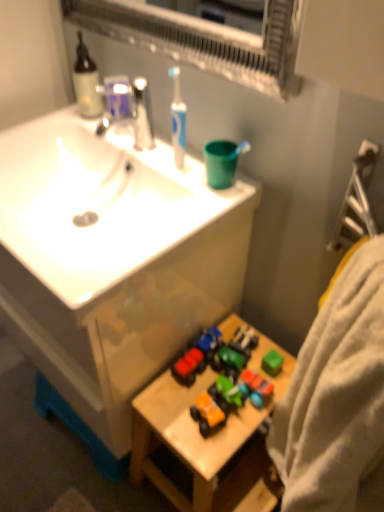
Question: Would you say translucent glass soap dispenser at upper left is a long distance from wooden toy at lower right?

Choices:
 (A) yes
 (B) no

Answer: (B)

Question: Is translucent glass soap dispenser at upper left oriented towards wooden toy at lower right?

Choices:
 (A) yes
 (B) no

Answer: (B)

Question: Is translucent glass soap dispenser at upper left looking in the opposite direction of wooden toy at lower right?

Choices:
 (A) yes
 (B) no

Answer: (B)

Question: Can you confirm if translucent glass soap dispenser at upper left is positioned to the left of wooden toy at lower right?

Choices:
 (A) no
 (B) yes

Answer: (B)

Question: From a real-world perspective, is translucent glass soap dispenser at upper left physically below wooden toy at lower right?

Choices:
 (A) no
 (B) yes

Answer: (A)

Question: Considering the positions of white glossy sink at upper left and translucent glass soap dispenser at upper left in the image, is white glossy sink at upper left taller or shorter than translucent glass soap dispenser at upper left?

Choices:
 (A) tall
 (B) short

Answer: (A)

Question: Looking at their shapes, would you say white glossy sink at upper left is wider or thinner than translucent glass soap dispenser at upper left?

Choices:
 (A) wide
 (B) thin

Answer: (A)

Question: Is point (112, 353) closer or farther from the camera than point (77, 46)?

Choices:
 (A) farther
 (B) closer

Answer: (B)

Question: From a real-world perspective, is white glossy sink at upper left positioned above or below translucent glass soap dispenser at upper left?

Choices:
 (A) below
 (B) above

Answer: (A)

Question: From their relative heights in the image, would you say orange matte toy car at lower center, acting as the third toy starting from the right, is taller or shorter than rubberized plastic toy car at center, which ranks as the second toy in right-to-left order?

Choices:
 (A) short
 (B) tall

Answer: (B)

Question: Would you say orange matte toy car at lower center, acting as the third toy starting from the right, is to the left or to the right of rubberized plastic toy car at center, which ranks as the second toy in right-to-left order, in the picture?

Choices:
 (A) right
 (B) left

Answer: (B)

Question: Does point (203, 402) appear closer or farther from the camera than point (203, 338)?

Choices:
 (A) farther
 (B) closer

Answer: (B)

Question: Is orange matte toy car at lower center, acting as the third toy starting from the right, spatially inside rubberized plastic toy car at center, which ranks as the second toy in right-to-left order, or outside of it?

Choices:
 (A) inside
 (B) outside

Answer: (B)

Question: In the image, is matte silver faucet at upper center on the left side or the right side of matte plastic toy car at center, the fourth toy from the right?

Choices:
 (A) right
 (B) left

Answer: (B)

Question: Considering their positions, is matte silver faucet at upper center located in front of or behind matte plastic toy car at center, which appears as the first toy when viewed from the left?

Choices:
 (A) behind
 (B) front

Answer: (B)